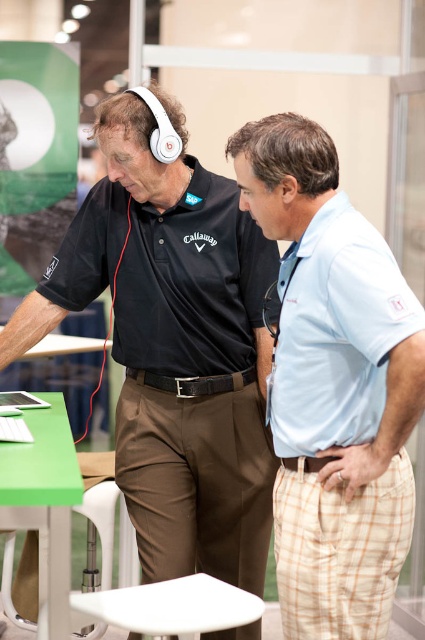
Question: Among these points, which one is farthest from the camera?

Choices:
 (A) (42, 496)
 (B) (184, 419)

Answer: (B)

Question: Is the position of green matte table at lower left less distant than that of white plastic stool at lower center?

Choices:
 (A) no
 (B) yes

Answer: (B)

Question: Which point is farther to the camera?

Choices:
 (A) light blue cotton polo shirt at right
 (B) black matte polo shirt at center
 (C) light blue cotton polo shirt at center
 (D) black matte headphones at upper left

Answer: (B)

Question: From the image, what is the correct spatial relationship of black matte headphones at upper left in relation to light blue cotton polo shirt at right?

Choices:
 (A) right
 (B) left

Answer: (B)

Question: Observing the image, what is the correct spatial positioning of light blue cotton polo shirt at center in reference to green matte table at lower left?

Choices:
 (A) below
 (B) above

Answer: (B)

Question: Among these points, which one is nearest to the camera?

Choices:
 (A) click(x=359, y=428)
 (B) click(x=272, y=256)
 (C) click(x=397, y=556)

Answer: (A)